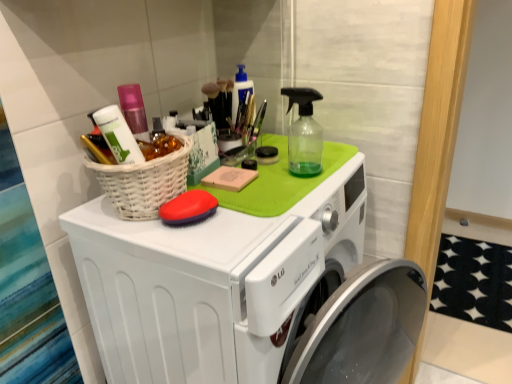
Locate an element on the screen. The height and width of the screenshot is (384, 512). vacant area that is in front of red rubber brush at center is located at coordinates (198, 249).